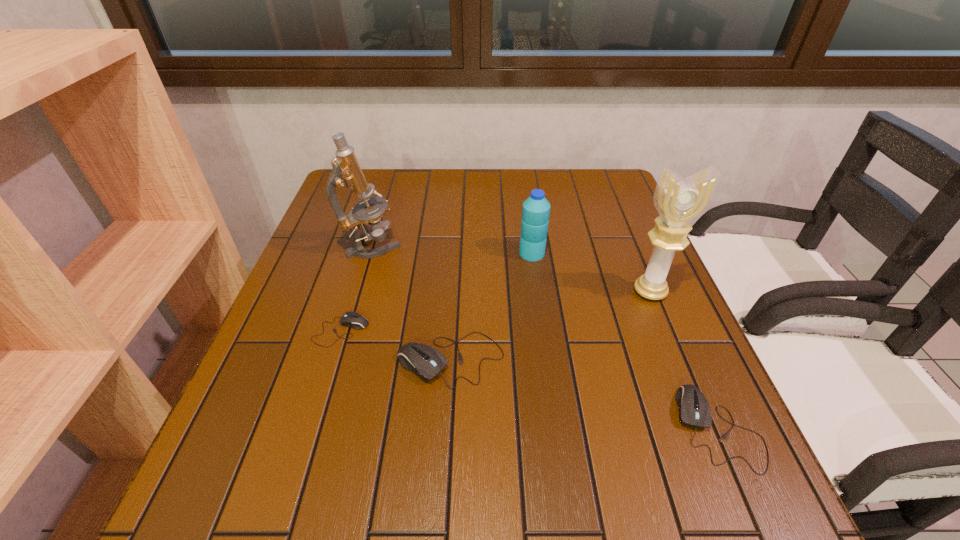
Where is `the leftmost computer mouse`? This screenshot has width=960, height=540. the leftmost computer mouse is located at coordinates (351, 319).

I want to click on the shortest computer mouse, so click(351, 319).

Where is `the fourth object from right to left`? This screenshot has height=540, width=960. the fourth object from right to left is located at coordinates (427, 362).

Where is `the rightmost computer mouse`? This screenshot has width=960, height=540. the rightmost computer mouse is located at coordinates (694, 410).

Find the location of `the second shortest object`. the second shortest object is located at coordinates (694, 410).

Locate an element on the screen. the third tallest object is located at coordinates (536, 209).

What are the coordinates of `the fourth object from left to right` in the screenshot? It's located at (536, 209).

At what (x,y) coordinates should I click in order to perform the action: click on microscope. Please return your answer as a coordinate pair (x, y). The height and width of the screenshot is (540, 960). Looking at the image, I should click on (346, 172).

You are a GUI agent. You are given a task and a screenshot of the screen. Output one action in this format:
    pyautogui.click(x=<x>, y=<y>)
    Task: Click on the third farthest object
    
    Given the screenshot: What is the action you would take?
    pyautogui.click(x=679, y=201)

Locate an element on the screen. This screenshot has height=540, width=960. vacant space positioned 0.090m on the left of the leftmost computer mouse is located at coordinates (272, 331).